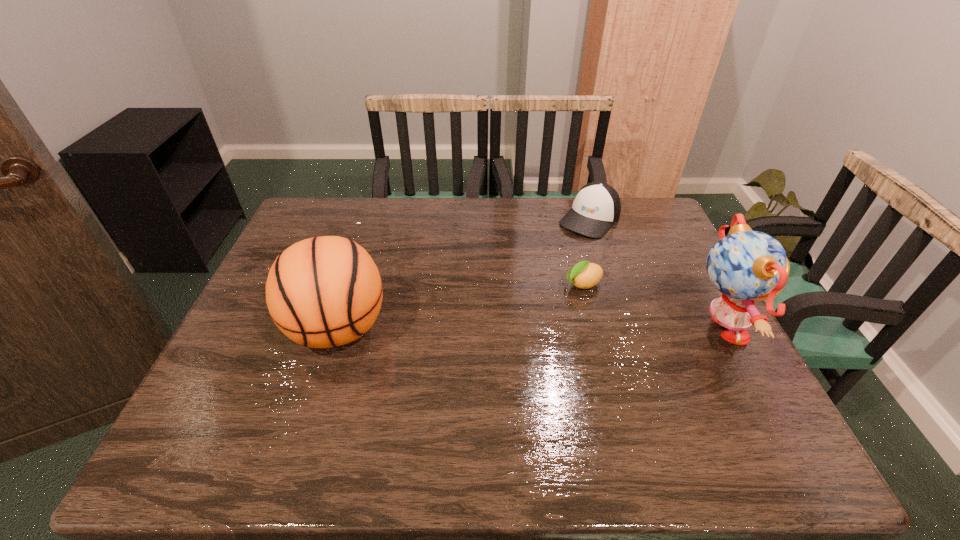
Identify the location of vacant space situated on the front panel of the cap. (567, 245).

At what (x,y) coordinates should I click in order to perform the action: click on vacant space located 0.140m on the front panel of the cap. Please return your answer as a coordinate pair (x, y). Looking at the image, I should click on (555, 259).

Image resolution: width=960 pixels, height=540 pixels. In order to click on object situated at the far edge in this screenshot , I will do `click(597, 206)`.

I want to click on object that is at the left edge, so click(x=322, y=292).

Where is `doll located in the right edge section of the desktop`? This screenshot has width=960, height=540. doll located in the right edge section of the desktop is located at coordinates [746, 266].

Find the location of a particular element. The image size is (960, 540). cap at the right edge is located at coordinates (597, 206).

Locate an element on the screen. This screenshot has height=540, width=960. object that is at the far right corner is located at coordinates (597, 206).

The height and width of the screenshot is (540, 960). Find the location of `free space at the far edge of the desktop`. free space at the far edge of the desktop is located at coordinates (428, 224).

In the image, there is a desktop. At what (x,y) coordinates should I click in order to perform the action: click on free region at the near edge. Please return your answer as a coordinate pair (x, y). The width and height of the screenshot is (960, 540). Looking at the image, I should click on (650, 399).

Where is `vacant area at the left edge`? The height and width of the screenshot is (540, 960). vacant area at the left edge is located at coordinates (263, 375).